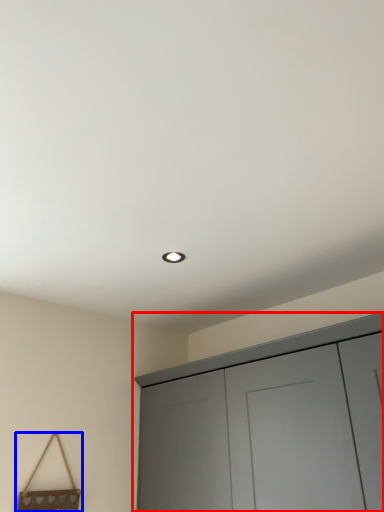
Question: Which of the following is the closest to the observer, cupboard (highlighted by a red box) or handbag (highlighted by a blue box)?

Choices:
 (A) cupboard
 (B) handbag

Answer: (A)